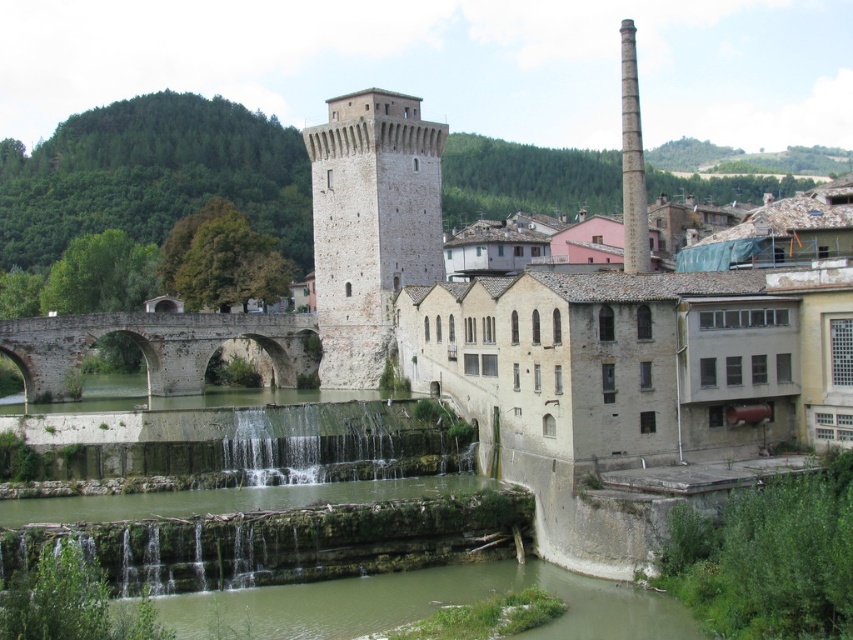
You are standing at the base of the tower and want to take a photo that includes both point (x=189, y=358) and point (x=630, y=195). Which point should you focus on first to ensure both are in clear view?

You should focus on point (x=189, y=358) first because it is closer to you than point (x=630, y=195), ensuring both points are within the camera focus range.

You are an architect analyzing the layout of this historical site. The smooth gray chimney at upper center is part of the tower mentioned in the scene. Based on its coordinates, is it positioned closer to the top or bottom of the tower?

The smooth gray chimney at upper center is located at point (370,225), which places it closer to the bottom of the tower since the y coordinate 0.435 is less than 0.5, indicating it is below the midpoint of the tower.